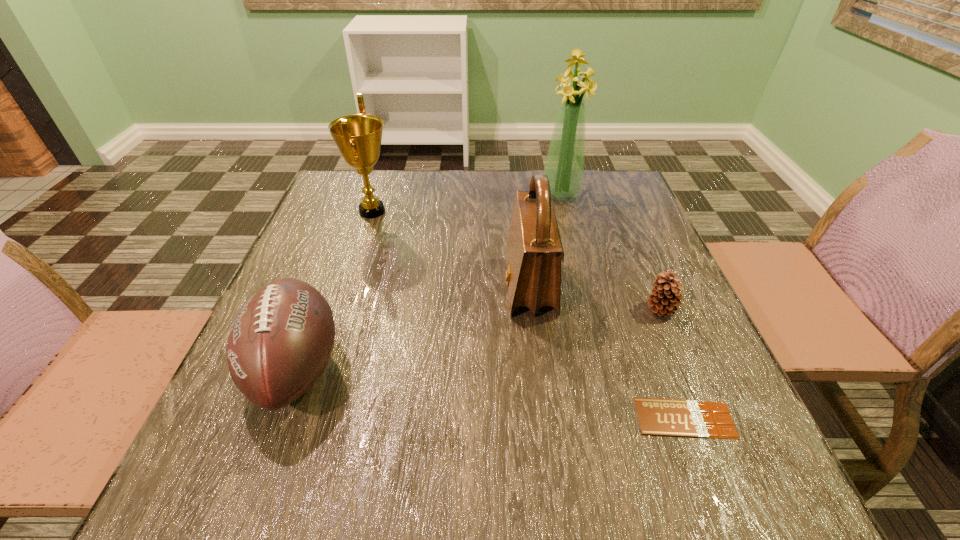
Identify the location of free region located on the front flap of the third object from left to right. (464, 286).

Where is `free point located on the right of the fourth tallest object`? This screenshot has width=960, height=540. free point located on the right of the fourth tallest object is located at coordinates (372, 368).

Locate an element on the screen. The height and width of the screenshot is (540, 960). free space located on the left of the pinecone is located at coordinates coord(606,309).

Where is `vacant space situated 0.240m on the back of the shortest object`? The image size is (960, 540). vacant space situated 0.240m on the back of the shortest object is located at coordinates (639, 298).

I want to click on bouquet located at the far edge, so click(564, 166).

Find the location of a particular element. award positioned at the far edge is located at coordinates (358, 137).

This screenshot has height=540, width=960. I want to click on award positioned at the left edge, so click(x=358, y=137).

Locate an element on the screen. The image size is (960, 540). football (American) that is at the left edge is located at coordinates (280, 342).

Identify the location of bouquet located in the right edge section of the desktop. The width and height of the screenshot is (960, 540). tap(564, 166).

Identify the location of pinecone that is at the right edge. (666, 296).